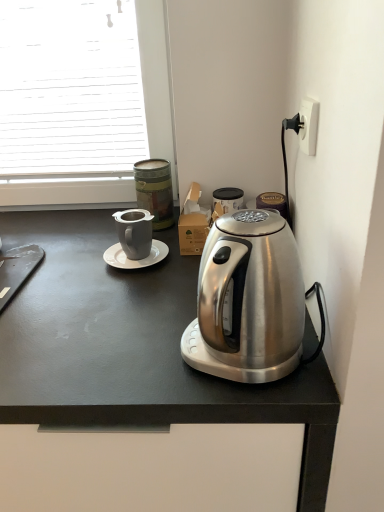
At what (x,y) coordinates should I click in order to perform the action: click on free point above satin silver kettle at center (from a real-world perspective). Please return your answer as a coordinate pair (x, y). The width and height of the screenshot is (384, 512). Looking at the image, I should click on (86, 273).